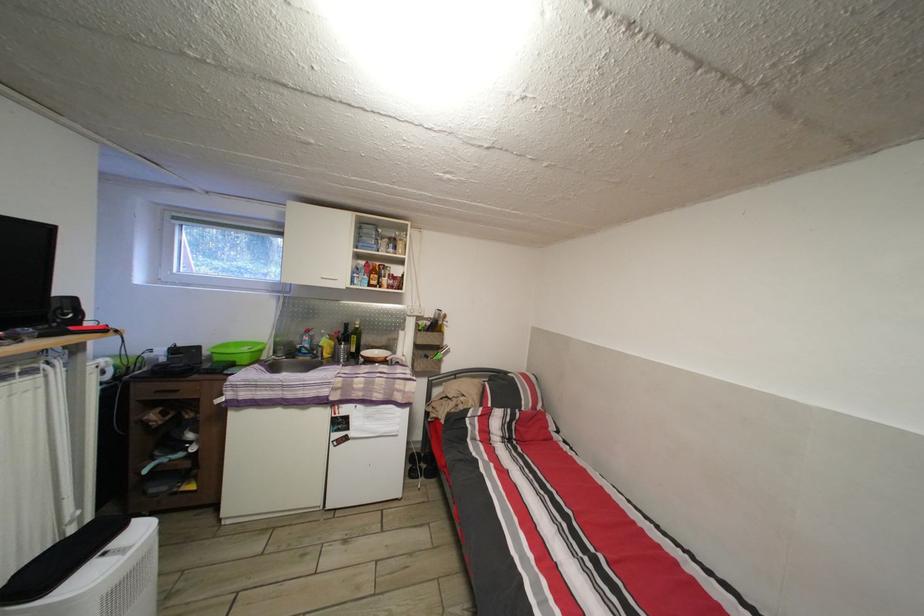
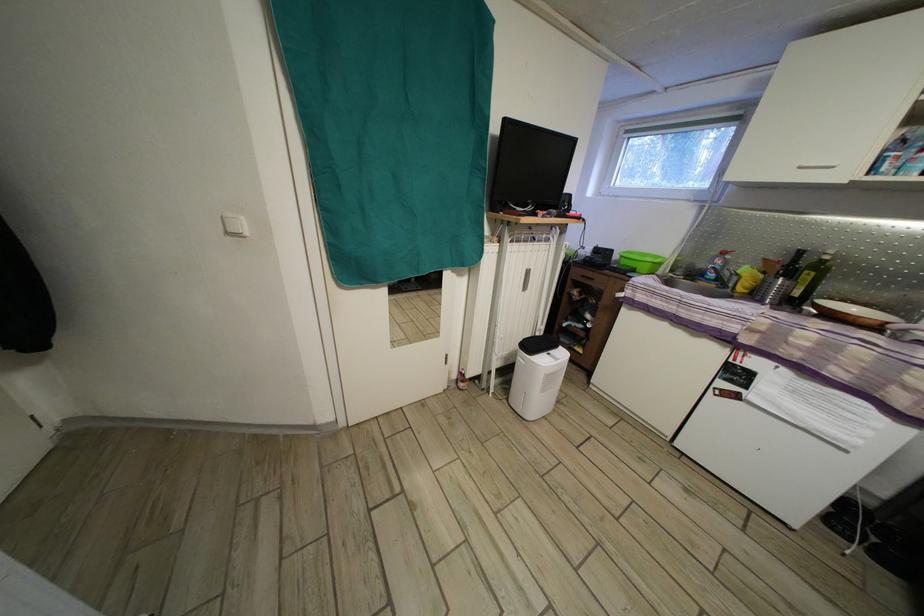
How did the camera likely rotate?

The camera rotated toward left-down.